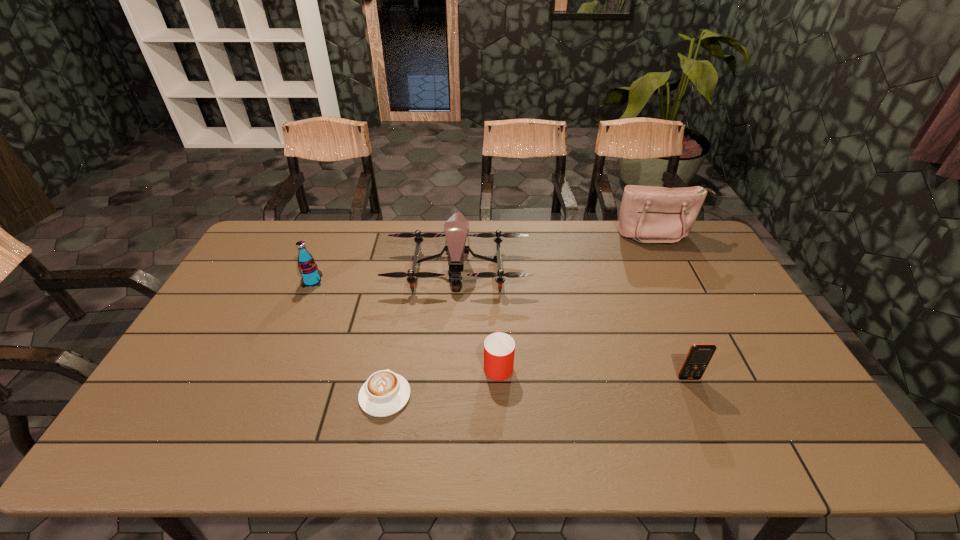
The height and width of the screenshot is (540, 960). In order to click on shoulder bag in this screenshot , I will do `click(648, 214)`.

At what (x,y) coordinates should I click in order to perform the action: click on drone. Please return your answer as a coordinate pair (x, y). The width and height of the screenshot is (960, 540). Looking at the image, I should click on (456, 228).

At what (x,y) coordinates should I click in order to perform the action: click on the leftmost object. Please return your answer as a coordinate pair (x, y). Looking at the image, I should click on (311, 276).

This screenshot has width=960, height=540. I want to click on the third shortest object, so click(698, 357).

Where is `the second shortest object`? the second shortest object is located at coordinates (499, 348).

You are a GUI agent. You are given a task and a screenshot of the screen. Output one action in this format:
    pyautogui.click(x=<x>, y=<y>)
    Task: Click on the shortest object
    The height and width of the screenshot is (540, 960).
    Given the screenshot: What is the action you would take?
    pyautogui.click(x=385, y=393)

Locate an element on the screen. This screenshot has height=540, width=960. vacant space situated on the front pocket of the shoulder bag is located at coordinates (701, 317).

Locate an element on the screen. free space located on the front-facing side of the drone is located at coordinates (456, 307).

Identify the location of vacant space located 0.120m on the right of the leftmost object. Image resolution: width=960 pixels, height=540 pixels. (359, 281).

Where is `free space located on the screen of the cellular telephone`? free space located on the screen of the cellular telephone is located at coordinates point(710,430).